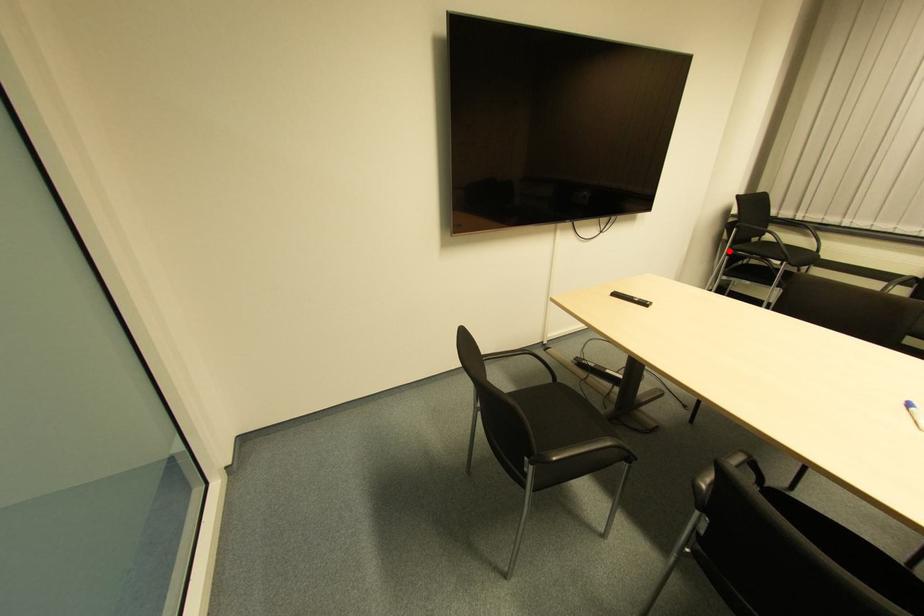
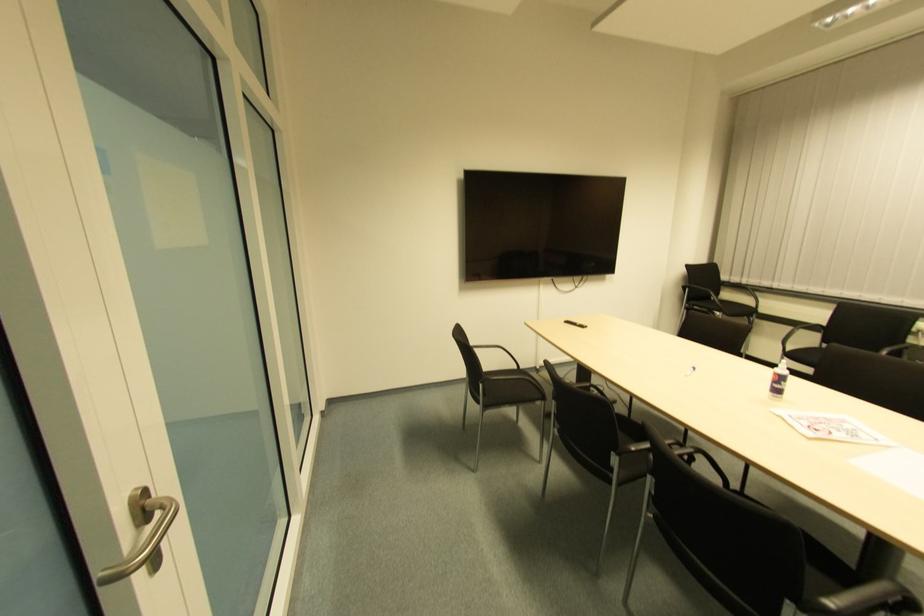
Question: I am providing you with two images of the same scene from different viewpoints. In image1, a red point is highlighted. Considering the same 3D point in image2, which of the following is correct?

Choices:
 (A) It is closer
 (B) It is farther

Answer: (A)